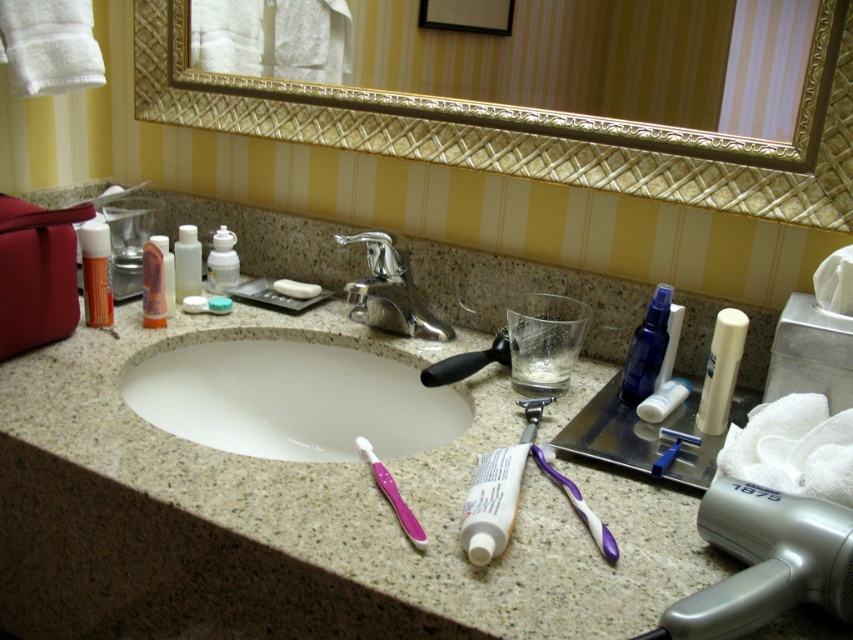
Is point (277, 365) farther from viewer compared to point (280, 285)?

That is False.

Is white glossy sink at center above white matte bar of soap at center?

Incorrect, white glossy sink at center is not positioned above white matte bar of soap at center.

Is point (238, 412) less distant than point (296, 291)?

Yes, it is in front of point (296, 291).

Identify the location of white glossy sink at center. (291, 400).

Is granite countertop at center closer to the viewer compared to white glossy sink at center?

That is True.

Which is more to the left, granite countertop at center or white glossy sink at center?

From the viewer's perspective, white glossy sink at center appears more on the left side.

Which is in front, point (433, 506) or point (206, 413)?

Point (433, 506) is more forward.

The image size is (853, 640). I want to click on granite countertop at center, so point(299,516).

Is translucent plastic bottles at center wider than translucent plastic soap dispenser at center?

Yes.

Measure the distance from translucent plastic bottles at center to translucent plastic soap dispenser at center.

A distance of 1.43 inches exists between translucent plastic bottles at center and translucent plastic soap dispenser at center.

At what (x,y) coordinates should I click in order to perform the action: click on translucent plastic bottles at center. Please return your answer as a coordinate pair (x, y). Looking at the image, I should click on (187, 262).